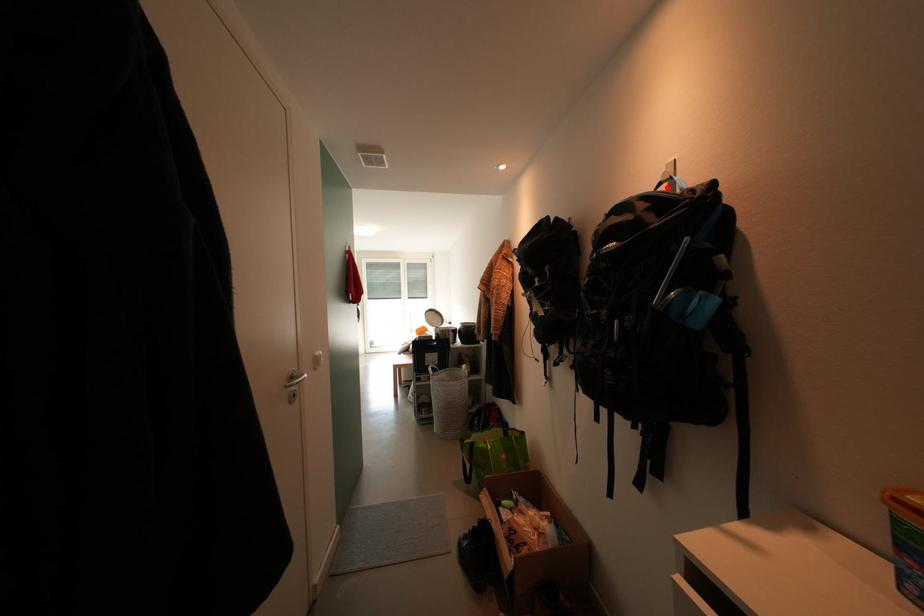
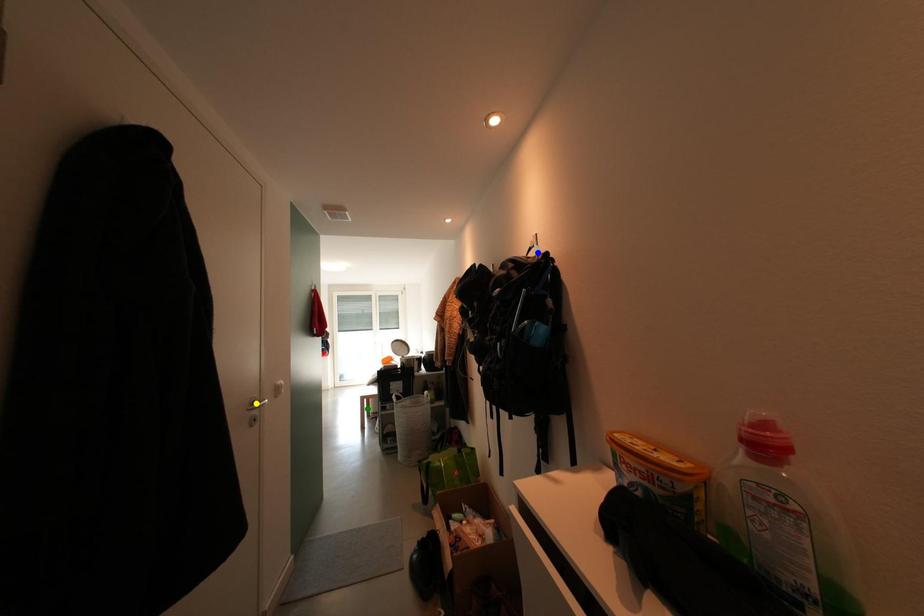
Question: I am providing you with two images of the same scene from different viewpoints. A red point is marked on the first image. You are given multiple points on the second image. Which spot in image 2 lines up with the point in image 1?

Choices:
 (A) green point
 (B) yellow point
 (C) blue point

Answer: (C)